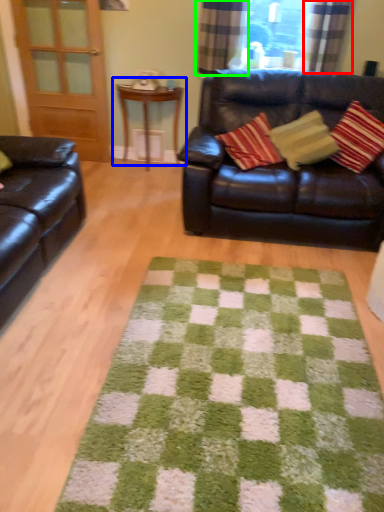
Question: Which object is the closest to the curtain (highlighted by a red box)? Choose among these: table (highlighted by a blue box) or curtain (highlighted by a green box).

Choices:
 (A) table
 (B) curtain

Answer: (B)